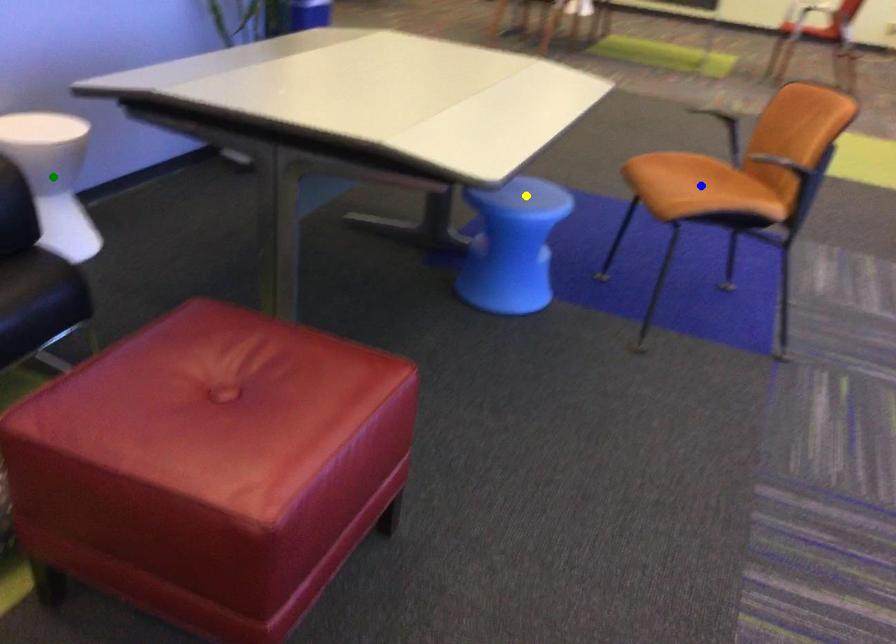
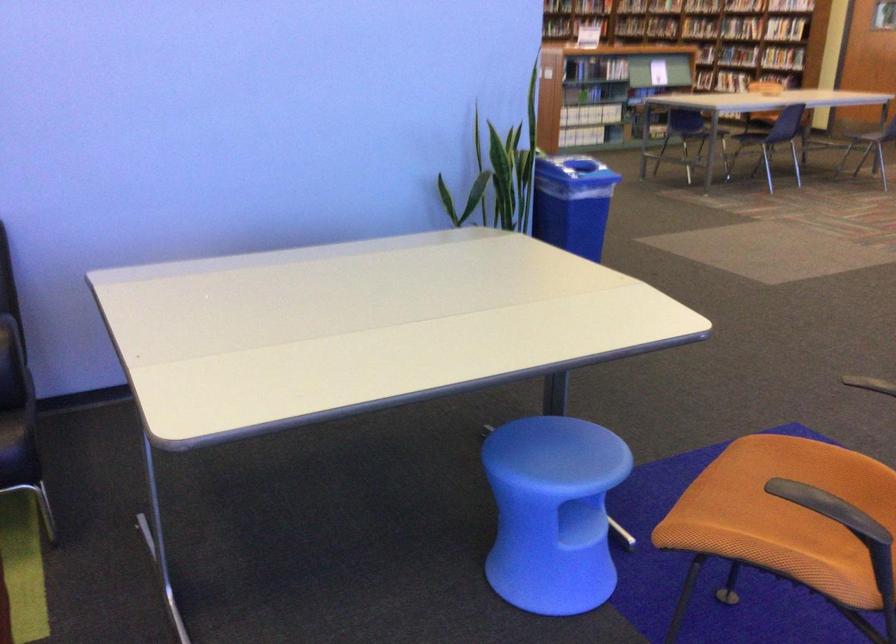
I am providing you with two images of the same scene from different viewpoints. Three points are marked in image1. Which point corresponds to a part or object that is occluded in image2?In image1, three points are marked. Which of them correspond to a part or object that is occluded in image2?Among the three points shown in image1, which one corresponds to a part or object that is no longer visible due to occlusion in image2?

green point cannot be seen in image2.